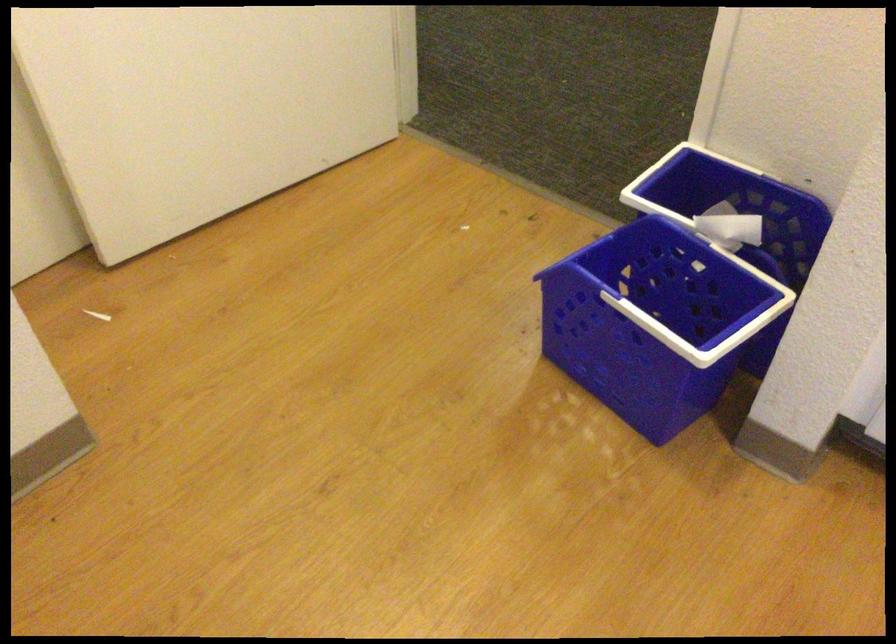
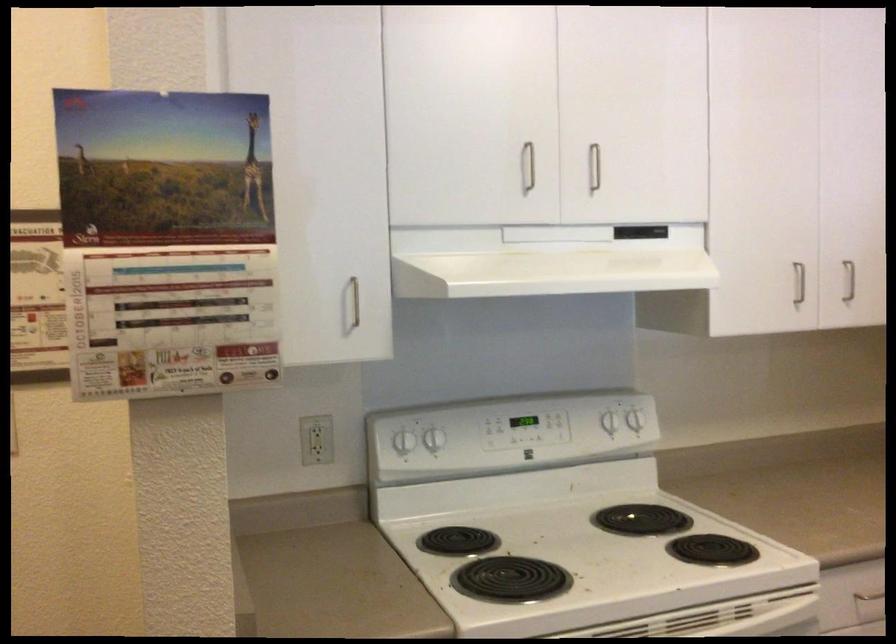
Question: The camera is either moving clockwise (left) or counter-clockwise (right) around the object. The first image is from the beginning of the video and the second image is from the end. Is the camera moving left or right when shooting the video?

Choices:
 (A) Left
 (B) Right

Answer: (A)